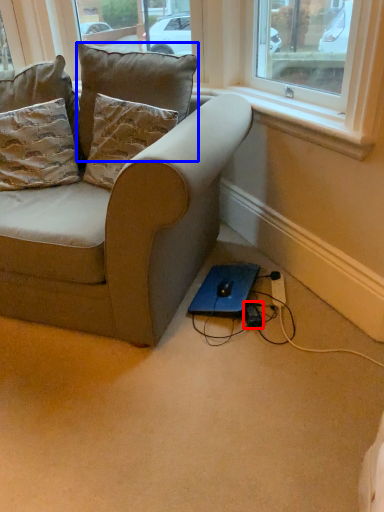
Question: Which object is closer to the camera taking this photo, plug (highlighted by a red box) or pillow (highlighted by a blue box)?

Choices:
 (A) plug
 (B) pillow

Answer: (B)